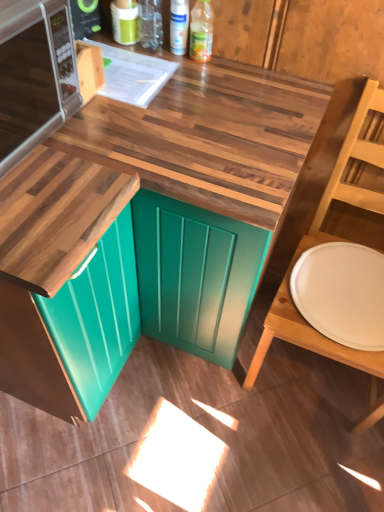
The height and width of the screenshot is (512, 384). I want to click on free space in front of wooden chair at right, so click(x=296, y=456).